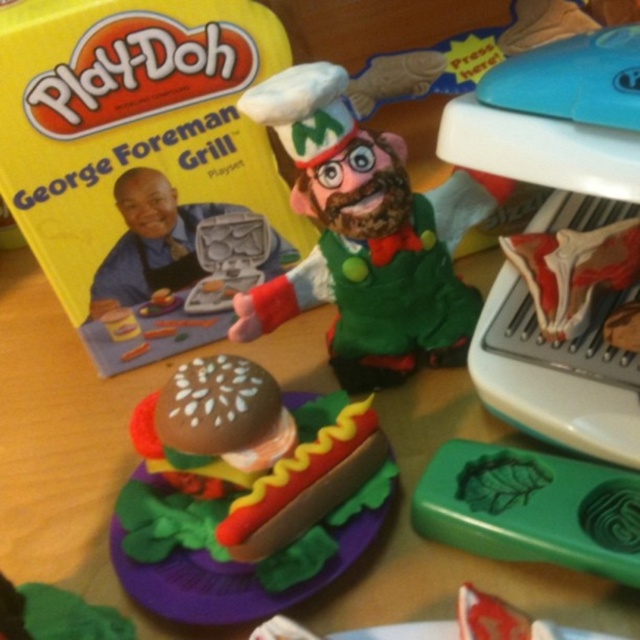
Can you confirm if green felt chef at center is positioned to the right of green matte leaf at lower right?

In fact, green felt chef at center is to the left of green matte leaf at lower right.

Looking at this image, can you confirm if green felt chef at center is positioned below green matte leaf at lower right?

No.

What do you see at coordinates (365, 237) in the screenshot? I see `green felt chef at center` at bounding box center [365, 237].

The image size is (640, 640). In order to click on green felt chef at center in this screenshot , I will do `click(365, 237)`.

Is point (289, 304) closer to camera compared to point (125, 513)?

No, (289, 304) is behind (125, 513).

Does green felt chef at center appear over matte plastic hot dog at center?

Yes, green felt chef at center is above matte plastic hot dog at center.

Measure the distance between green felt chef at center and camera.

They are 66.32 centimeters apart.

Identify the location of green felt chef at center. This screenshot has width=640, height=640. (365, 237).

How distant is matte plastic hot dog at center from green matte leaf at lower right?

matte plastic hot dog at center is 6.43 inches away from green matte leaf at lower right.

Can you confirm if matte plastic hot dog at center is taller than green matte leaf at lower right?

Yes.

Who is more forward, (305, 552) or (493, 554)?

Positioned in front is point (493, 554).

The image size is (640, 640). Identify the location of matte plastic hot dog at center. (243, 493).